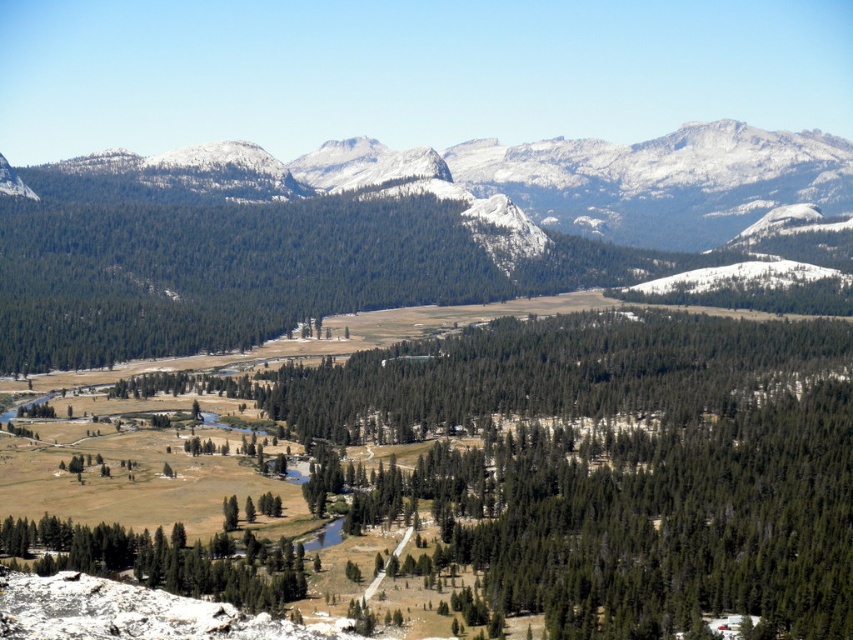
You are a hiker planning to take a photo of the snowy granite mountains at upper center. You want to ensure the mountains are centered in your shot. Given their coordinates at point 0.281, 0.606, where should you position your camera to frame them properly?

To center the snowy granite mountains at upper center, position your camera so that the crosshairs align with the coordinates 0.281 on the horizontal axis and 0.606 on the vertical axis, ensuring the mountains are precisely centered in your frame.

Consider the image. You are an environmental scientist analyzing the landscape. You observe the snowy granite mountains at upper center and the green matte tree at lower left. Which object has a greater width in the image?

The snowy granite mountains at upper center have a greater width than the green matte tree at lower left.